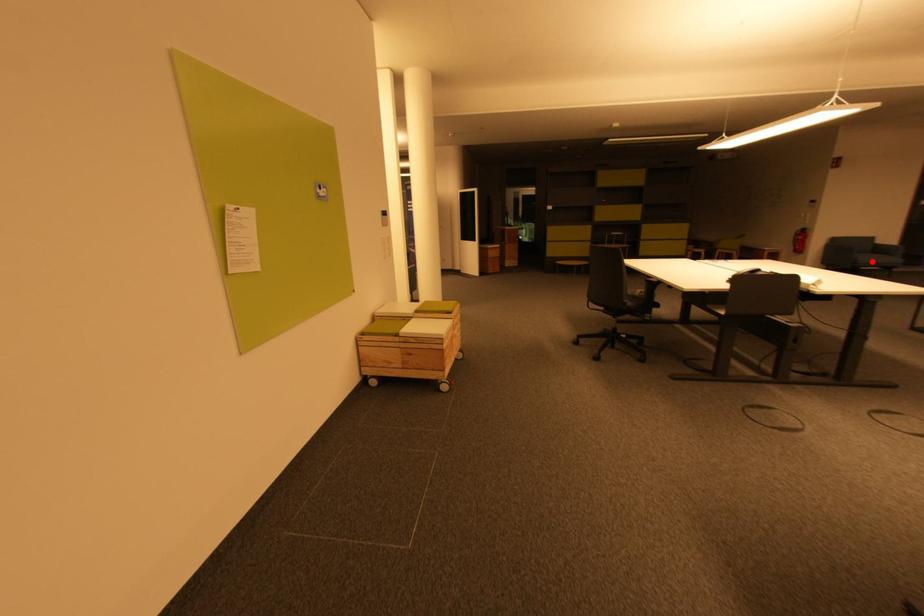
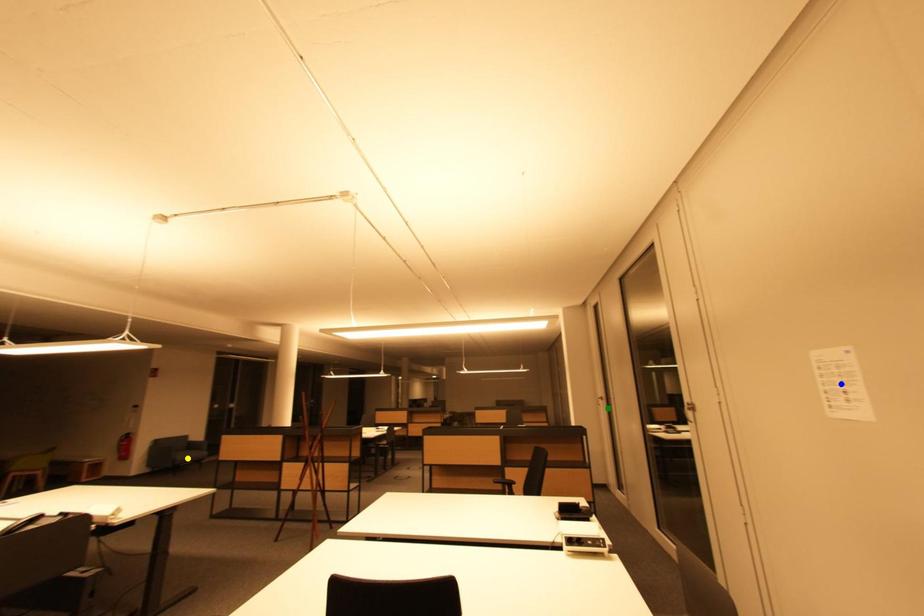
Question: I am providing you with two images of the same scene from different viewpoints. A red point is marked on the first image. You are given multiple points on the second image. In image 2, which mark is for the same physical point as the one in image 1?

Choices:
 (A) yellow point
 (B) green point
 (C) blue point

Answer: (A)